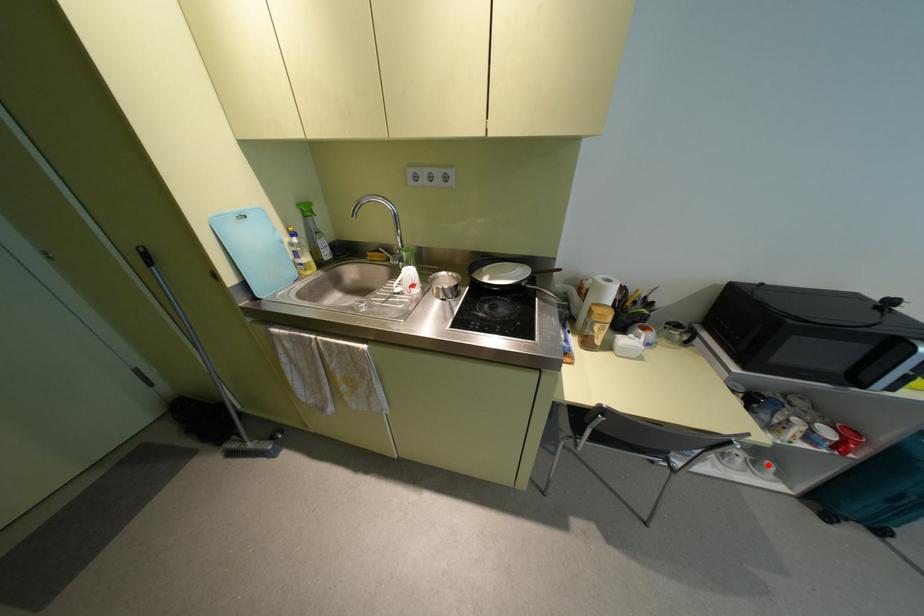
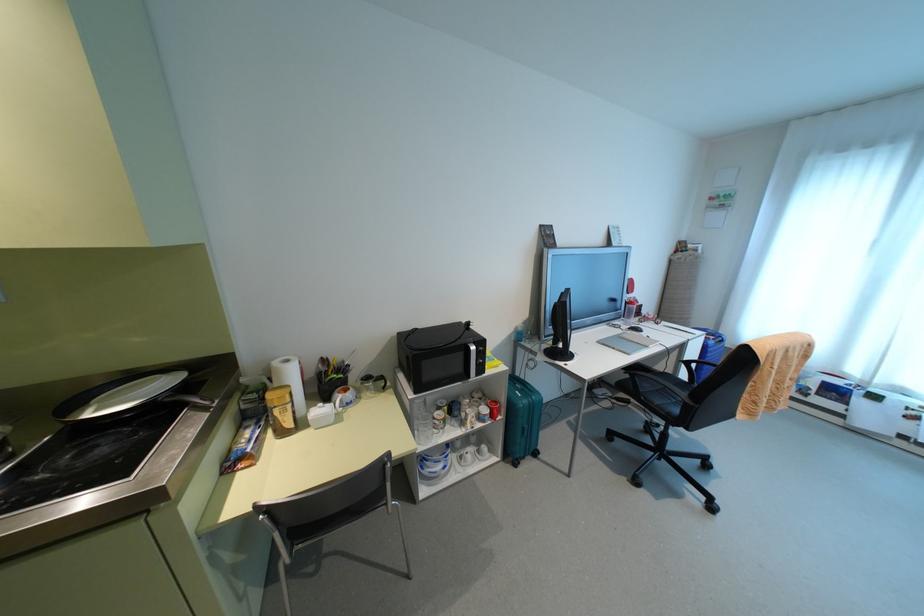
Question: I am providing you with two images of the same scene from different viewpoints. In image1, a red point is highlighted. Considering the same 3D point in image2, which of the following is correct?

Choices:
 (A) It is closer
 (B) It is farther

Answer: (B)